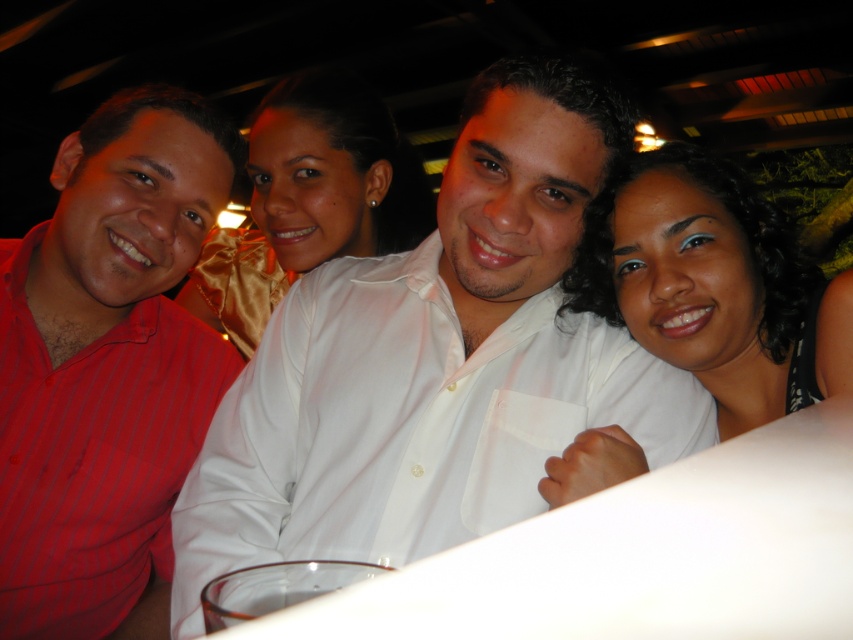
You are a photographer at a social event and need to adjust the lighting to ensure both the white satin shirt at center and the white satin blouse at center are well lit. Since they are both white, you want to avoid overexposure. Which one might require more careful adjustment due to its size?

The white satin shirt at center is wider than the white satin blouse at center, so it might require more careful adjustment to avoid overexposure because of its larger size.

You are standing in front of the group photo and want to identify the person wearing the white satin shirt at center. Based on their position in the image, can you tell me the exact coordinates of where they are standing?

The white satin shirt at center is located at the 2D coordinates point (x=405, y=422).

You are a photographer holding a camera. You want to ensure that the white satin shirt at center is in focus while capturing the group photo. Given that your camera has a depth of field that can sharply focus on objects within 25 inches of the current focus point, what adjustment should you make to the focus distance?

Since the white satin shirt at center is 27.61 inches away from the camera and the depth of field can only sharply focus within 25 inches of the focus point, you need to adjust the focus distance to be closer to the white satin shirt at center. Specifically, set the focus point to approximately 2.61 inches in front of the white satin shirt at center to ensure it falls within the 25 inch range of sharp focus.